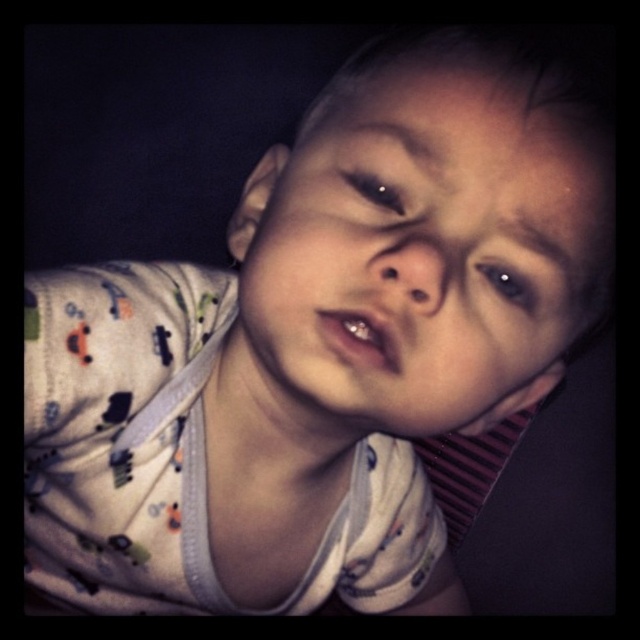
Is brown glossy eye at upper center wider than black glossy eye at upper center?

Yes, brown glossy eye at upper center is wider than black glossy eye at upper center.

Can you confirm if brown glossy eye at upper center is shorter than black glossy eye at upper center?

Incorrect, brown glossy eye at upper center's height does not fall short of black glossy eye at upper center's.

Does point (516, 305) come in front of point (362, 173)?

No, (516, 305) is behind (362, 173).

The width and height of the screenshot is (640, 640). Find the location of `brown glossy eye at upper center`. brown glossy eye at upper center is located at coordinates (508, 284).

Does smooth skin face at center come behind black glossy eye at upper center?

No, it is not.

Who is more distant from viewer, (x=444, y=371) or (x=355, y=188)?

Positioned behind is point (x=355, y=188).

The width and height of the screenshot is (640, 640). Find the location of `smooth skin face at center`. smooth skin face at center is located at coordinates (419, 253).

Which is more to the left, smooth skin face at center or brown glossy eye at upper center?

From the viewer's perspective, smooth skin face at center appears more on the left side.

Which is above, smooth skin face at center or brown glossy eye at upper center?

Positioned higher is brown glossy eye at upper center.

Which is behind, point (371, 285) or point (516, 305)?

Point (516, 305)

Where is `smooth skin face at center`? This screenshot has width=640, height=640. smooth skin face at center is located at coordinates (419, 253).